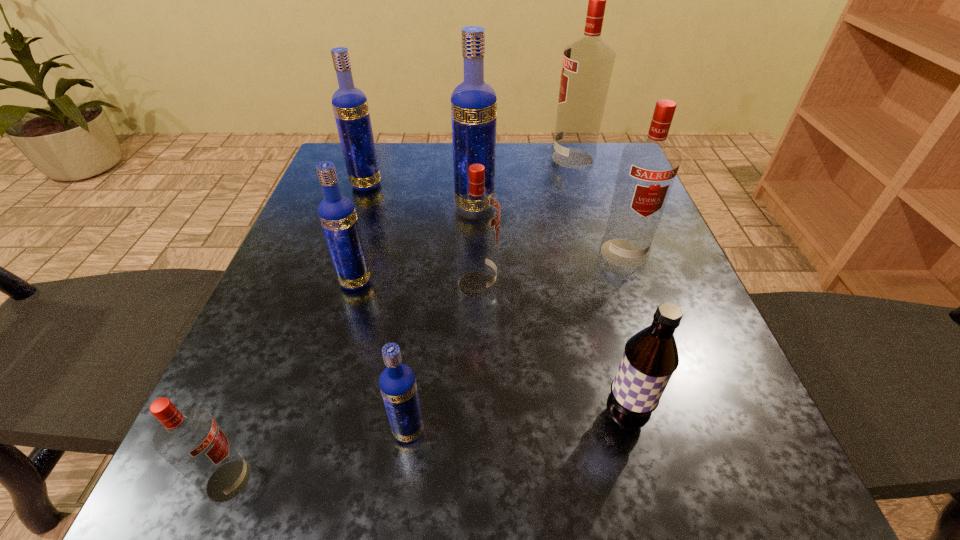
Locate an element on the screen. The height and width of the screenshot is (540, 960). the second smallest red vodka is located at coordinates (476, 214).

Image resolution: width=960 pixels, height=540 pixels. What are the coordinates of `root beer` in the screenshot? It's located at (650, 358).

Where is `the fourth vodka from left to right`? the fourth vodka from left to right is located at coordinates (397, 382).

The width and height of the screenshot is (960, 540). In order to click on the fourth object from left to right in this screenshot , I will do `click(397, 382)`.

At what (x,y) coordinates should I click in order to perform the action: click on the leftmost red vodka. Please return your answer as a coordinate pair (x, y). This screenshot has width=960, height=540. Looking at the image, I should click on (189, 439).

Identify the location of the smallest red vodka. (189, 439).

You are a GUI agent. You are given a task and a screenshot of the screen. Output one action in this format:
    pyautogui.click(x=<x>, y=<y>)
    Task: Click on the vacant position located 0.220m on the front label of the farthest object
    The width and height of the screenshot is (960, 540).
    Given the screenshot: What is the action you would take?
    pyautogui.click(x=466, y=158)

Locate an element on the screen. Image resolution: width=960 pixels, height=540 pixels. vacant area situated on the front label of the farthest object is located at coordinates (426, 158).

This screenshot has width=960, height=540. In order to click on free space located 0.190m on the front label of the farthest object in this screenshot , I will do `click(477, 158)`.

Identify the location of vacant space situated on the right of the biggest blue vodka. (553, 207).